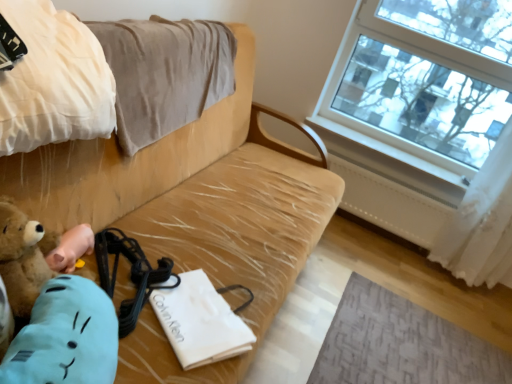
The image size is (512, 384). What are the coordinates of `vacant region above white painted wood at upper right (from a real-world perspective)` in the screenshot? It's located at (389, 142).